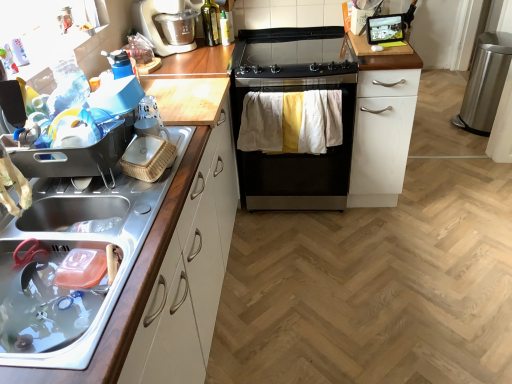
Question: Considering their positions, is metallic sink at left, positioned as the second cabinetry in back-to-front order, located in front of or behind satin silver coffee machine at upper left?

Choices:
 (A) behind
 (B) front

Answer: (B)

Question: Is metallic sink at left, the first cabinetry viewed from the front, spatially inside satin silver coffee machine at upper left, or outside of it?

Choices:
 (A) outside
 (B) inside

Answer: (A)

Question: Estimate the real-world distances between objects in this image. Which object is farther from the black glass-top gas stove at center?

Choices:
 (A) white matte cabinet at center-right, the 2th cabinetry from the left
 (B) satin silver coffee machine at upper left
 (C) green glass bottle at upper center, the 1th bottle viewed from the left
 (D) metallic sink at left, the first cabinetry viewed from the front
 (E) translucent plastic spray bottle at upper center, the 2th bottle positioned from the left

Answer: (D)

Question: Which of these objects is positioned closest to the translucent plastic spray bottle at upper center, placed as the 1th bottle when sorted from right to left?

Choices:
 (A) black glass-top gas stove at center
 (B) black stainless steel stove at center
 (C) metallic sink at left, positioned as the second cabinetry in back-to-front order
 (D) satin silver coffee machine at upper left
 (E) white matte cabinet at center-right, the first cabinetry when ordered from right to left

Answer: (D)